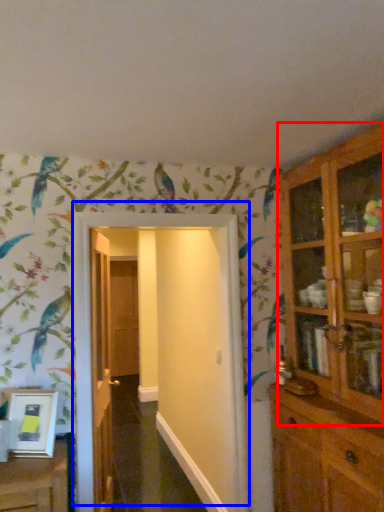
Question: Which object is closer to the camera taking this photo, cupboard (highlighted by a red box) or door (highlighted by a blue box)?

Choices:
 (A) cupboard
 (B) door

Answer: (A)